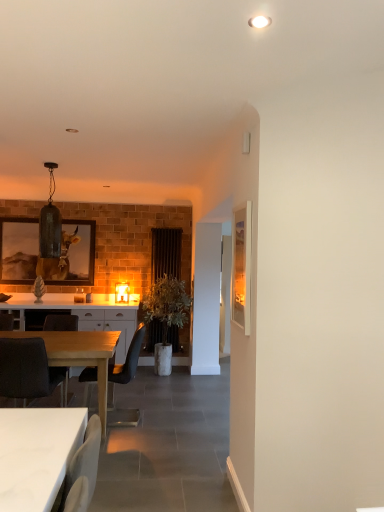
Question: Is matte glass lampshade at center, which is counted as the first lamp, starting from the right, thinner than matte black chair at center, marked as the second chair in a front-to-back arrangement?

Choices:
 (A) no
 (B) yes

Answer: (B)

Question: Considering the relative positions of matte glass lampshade at center, the 2th lamp positioned from the top, and matte black chair at center, marked as the second chair in a front-to-back arrangement, in the image provided, is matte glass lampshade at center, the 2th lamp positioned from the top, behind matte black chair at center, marked as the second chair in a front-to-back arrangement,?

Choices:
 (A) yes
 (B) no

Answer: (A)

Question: Does matte glass lampshade at center, which is counted as the first lamp, starting from the right, lie in front of matte black chair at center, marked as the second chair in a front-to-back arrangement?

Choices:
 (A) no
 (B) yes

Answer: (A)

Question: Is matte black chair at center, marked as the 2th chair in a back-to-front arrangement, at the back of matte glass lampshade at center, which is the 1th lamp in back-to-front order?

Choices:
 (A) yes
 (B) no

Answer: (B)

Question: From a real-world perspective, is matte glass lampshade at center, which is the 1th lamp from bottom to top, under matte black chair at center, marked as the 2th chair in a back-to-front arrangement?

Choices:
 (A) yes
 (B) no

Answer: (B)

Question: Is matte black chair at center, marked as the second chair in a front-to-back arrangement, bigger or smaller than light wood table at lower left, which is counted as the first desk, starting from the left?

Choices:
 (A) small
 (B) big

Answer: (A)

Question: In the image, is matte black chair at center, marked as the second chair in a front-to-back arrangement, on the left side or the right side of light wood table at lower left, which is the second desk from front to back?

Choices:
 (A) left
 (B) right

Answer: (B)

Question: Relative to light wood table at lower left, which is counted as the first desk, starting from the left, is matte black chair at center, marked as the 2th chair in a back-to-front arrangement, in front or behind?

Choices:
 (A) front
 (B) behind

Answer: (B)

Question: From the image's perspective, is matte black chair at center, marked as the second chair in a front-to-back arrangement, above or below light wood table at lower left, marked as the second desk in a right-to-left arrangement?

Choices:
 (A) below
 (B) above

Answer: (B)

Question: In terms of height, does black fabric curtain at center look taller or shorter compared to wooden framed artwork at left, placed as the 1th picture frame when sorted from left to right?

Choices:
 (A) tall
 (B) short

Answer: (A)

Question: From a real-world perspective, is black fabric curtain at center physically located above or below wooden framed artwork at left, placed as the second picture frame when sorted from front to back?

Choices:
 (A) above
 (B) below

Answer: (B)

Question: In the image, is black fabric curtain at center positioned in front of or behind wooden framed artwork at left, positioned as the 1th picture frame in back-to-front order?

Choices:
 (A) front
 (B) behind

Answer: (A)

Question: Is black fabric curtain at center wider or thinner than wooden framed artwork at left, positioned as the 1th picture frame in back-to-front order?

Choices:
 (A) thin
 (B) wide

Answer: (B)

Question: Considering the positions of point (54, 262) and point (34, 461), is point (54, 262) closer or farther from the camera than point (34, 461)?

Choices:
 (A) farther
 (B) closer

Answer: (A)

Question: Considering the positions of wooden framed artwork at left, placed as the second picture frame when sorted from front to back, and white glossy table at lower left, the 2th desk from the left, in the image, is wooden framed artwork at left, placed as the second picture frame when sorted from front to back, bigger or smaller than white glossy table at lower left, the 2th desk from the left,?

Choices:
 (A) small
 (B) big

Answer: (B)